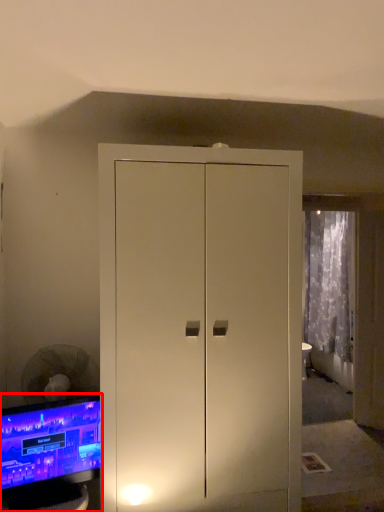
Question: In this image, where is computer monitor (annotated by the red box) located relative to curtain?

Choices:
 (A) left
 (B) right

Answer: (A)